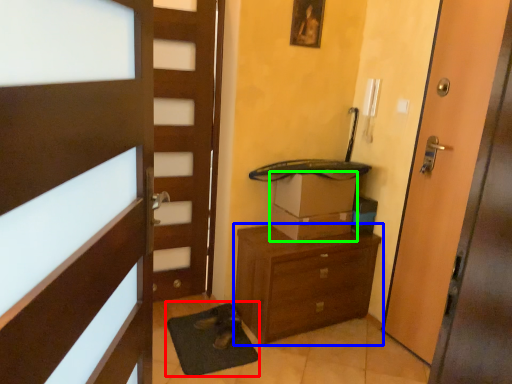
Question: Which is nearer to the bath mat (highlighted by a red box)? chest of drawers (highlighted by a blue box) or cardboard box (highlighted by a green box).

Choices:
 (A) chest of drawers
 (B) cardboard box

Answer: (A)